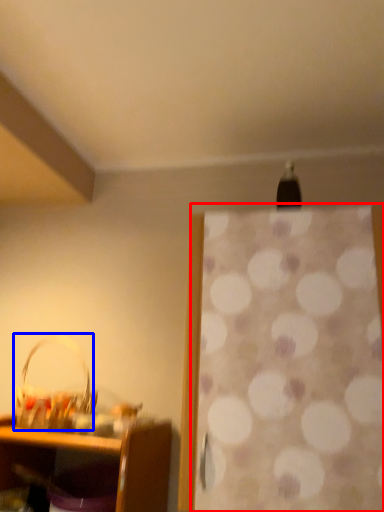
Question: Which object is closer to the camera taking this photo, curtain (highlighted by a red box) or basket (highlighted by a blue box)?

Choices:
 (A) curtain
 (B) basket

Answer: (A)